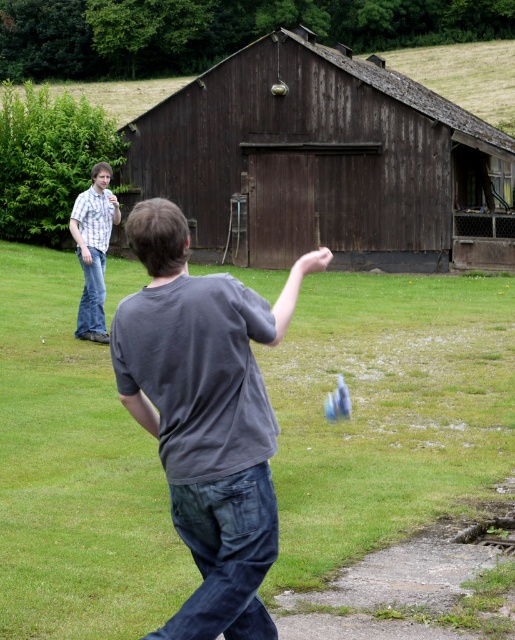
Who is positioned more to the right, dark wood barn at center or dark gray t-shirt at center?

From the viewer's perspective, dark wood barn at center appears more on the right side.

Looking at this image, does dark wood barn at center have a larger size compared to dark gray t-shirt at center?

Indeed, dark wood barn at center has a larger size compared to dark gray t-shirt at center.

The width and height of the screenshot is (515, 640). Find the location of `dark wood barn at center`. dark wood barn at center is located at coordinates (325, 163).

Is dark gray t-shirt at center bigger than plaid shirt at left?

Correct, dark gray t-shirt at center is larger in size than plaid shirt at left.

Which is more to the left, dark gray t-shirt at center or plaid shirt at left?

plaid shirt at left

Locate an element on the screen. The height and width of the screenshot is (640, 515). dark gray t-shirt at center is located at coordinates (206, 417).

Where is `dark gray t-shirt at center`? dark gray t-shirt at center is located at coordinates (206, 417).

What do you see at coordinates (325, 163) in the screenshot? I see `dark wood barn at center` at bounding box center [325, 163].

Image resolution: width=515 pixels, height=640 pixels. I want to click on dark wood barn at center, so click(x=325, y=163).